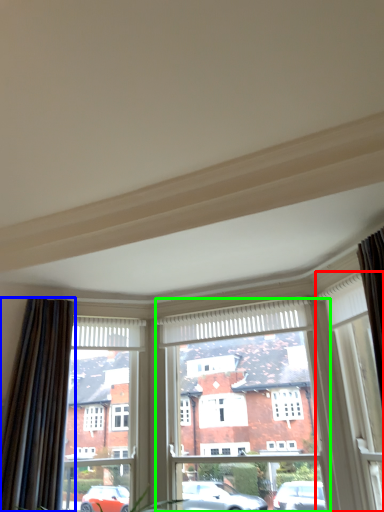
Question: Which object is the closest to the window (highlighted by a red box)? Choose among these: curtain (highlighted by a blue box) or window frame (highlighted by a green box).

Choices:
 (A) curtain
 (B) window frame

Answer: (B)